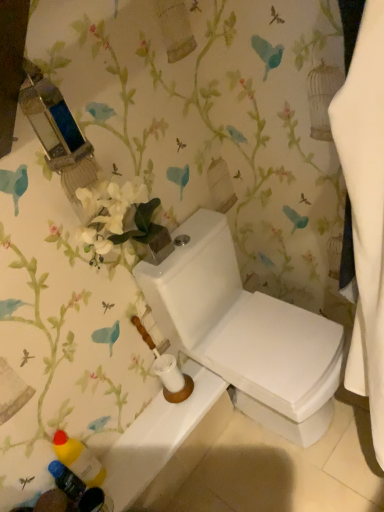
The height and width of the screenshot is (512, 384). I want to click on translucent plastic bottles at lower left, which ranks as the second toiletry in bottom-to-top order, so click(78, 459).

What do you see at coordinates (245, 332) in the screenshot? I see `white glossy toilet at center` at bounding box center [245, 332].

What do you see at coordinates (67, 480) in the screenshot? The image size is (384, 512). I see `blue plastic bottle at lower left, which ranks as the 1th toiletry in bottom-to-top order` at bounding box center [67, 480].

Locate an element on the screen. The width and height of the screenshot is (384, 512). white glossy toilet at lower center is located at coordinates (166, 442).

From a real-world perspective, between white glossy toilet at lower center and blue plastic bottle at lower left, which ranks as the 1th toiletry in bottom-to-top order, who is vertically higher?

From a 3D spatial view, blue plastic bottle at lower left, which ranks as the 1th toiletry in bottom-to-top order, is above.

Which is in front, point (201, 374) or point (61, 477)?

Positioned in front is point (61, 477).

Can you confirm if white glossy toilet at lower center is taller than blue plastic bottle at lower left, marked as the 2th toiletry in a top-to-bottom arrangement?

In fact, white glossy toilet at lower center may be shorter than blue plastic bottle at lower left, marked as the 2th toiletry in a top-to-bottom arrangement.

Which object is positioned more to the left, white glossy toilet at lower center or blue plastic bottle at lower left, which ranks as the 1th toiletry in bottom-to-top order?

blue plastic bottle at lower left, which ranks as the 1th toiletry in bottom-to-top order, is more to the left.

From the picture: Considering the sizes of objects blue plastic bottle at lower left, which ranks as the 1th toiletry in bottom-to-top order, and white glossy toilet at lower center in the image provided, who is wider, blue plastic bottle at lower left, which ranks as the 1th toiletry in bottom-to-top order, or white glossy toilet at lower center?

Wider between the two is white glossy toilet at lower center.

Is blue plastic bottle at lower left, which ranks as the 1th toiletry in bottom-to-top order, facing towards white glossy toilet at lower center?

A: No.

Considering the positions of points (82, 492) and (125, 449), is point (82, 492) closer to camera compared to point (125, 449)?

Yes, it is.

In the image, is blue plastic bottle at lower left, marked as the 2th toiletry in a top-to-bottom arrangement, positioned in front of or behind white glossy toilet at lower center?

Visually, blue plastic bottle at lower left, marked as the 2th toiletry in a top-to-bottom arrangement, is located in front of white glossy toilet at lower center.

Which point is more distant from viewer, (207, 255) or (59, 484)?

Positioned behind is point (207, 255).

Is white glossy toilet at center not inside blue plastic bottle at lower left, marked as the 2th toiletry in a top-to-bottom arrangement?

Yes, white glossy toilet at center is outside of blue plastic bottle at lower left, marked as the 2th toiletry in a top-to-bottom arrangement.

From the image's perspective, between white glossy toilet at center and blue plastic bottle at lower left, which ranks as the 1th toiletry in bottom-to-top order, who is located below?

blue plastic bottle at lower left, which ranks as the 1th toiletry in bottom-to-top order, is shown below in the image.

Is white glossy toilet at center facing away from blue plastic bottle at lower left, marked as the 2th toiletry in a top-to-bottom arrangement?

No, white glossy toilet at center's orientation is not away from blue plastic bottle at lower left, marked as the 2th toiletry in a top-to-bottom arrangement.

The image size is (384, 512). What are the coordinates of `toilet positioned vertically above the blue plastic bottle at lower left, which ranks as the 1th toiletry in bottom-to-top order (from a real-world perspective)` in the screenshot? It's located at (245, 332).

Considering the positions of objects blue plastic bottle at lower left, marked as the 2th toiletry in a top-to-bottom arrangement, and white glossy toilet at center in the image provided, who is more to the right, blue plastic bottle at lower left, marked as the 2th toiletry in a top-to-bottom arrangement, or white glossy toilet at center?

white glossy toilet at center.

From the image's perspective, is blue plastic bottle at lower left, marked as the 2th toiletry in a top-to-bottom arrangement, located above white glossy toilet at center?

Actually, blue plastic bottle at lower left, marked as the 2th toiletry in a top-to-bottom arrangement, appears below white glossy toilet at center in the image.

From a real-world perspective, is blue plastic bottle at lower left, which ranks as the 1th toiletry in bottom-to-top order, positioned under white glossy toilet at center based on gravity?

Correct, in the physical world, blue plastic bottle at lower left, which ranks as the 1th toiletry in bottom-to-top order, is lower than white glossy toilet at center.

Considering the relative sizes of white glossy toilet at lower center and white glossy toilet at center in the image provided, is white glossy toilet at lower center shorter than white glossy toilet at center?

Correct, white glossy toilet at lower center is not as tall as white glossy toilet at center.

Is white glossy toilet at lower center bigger or smaller than white glossy toilet at center?

In the image, white glossy toilet at lower center appears to be smaller than white glossy toilet at center.

In the image, is white glossy toilet at lower center on the left side or the right side of white glossy toilet at center?

From the image, it's evident that white glossy toilet at lower center is to the left of white glossy toilet at center.

Is point (171, 414) in front of point (138, 280)?

No.

From a real-world perspective, is translucent plastic bottles at lower left, which appears as the 1th toiletry when viewed from the top, located beneath white glossy toilet at lower center?

No, from a real-world perspective, translucent plastic bottles at lower left, which appears as the 1th toiletry when viewed from the top, is not below white glossy toilet at lower center.

Which object is thinner, translucent plastic bottles at lower left, which appears as the 1th toiletry when viewed from the top, or white glossy toilet at lower center?

translucent plastic bottles at lower left, which appears as the 1th toiletry when viewed from the top.

In the scene shown: Is translucent plastic bottles at lower left, which appears as the 1th toiletry when viewed from the top, located outside white glossy toilet at lower center?

That's correct, translucent plastic bottles at lower left, which appears as the 1th toiletry when viewed from the top, is outside of white glossy toilet at lower center.

Which object is more forward, white glossy toilet at lower center or translucent plastic bottles at lower left, which ranks as the second toiletry in bottom-to-top order?

Positioned in front is translucent plastic bottles at lower left, which ranks as the second toiletry in bottom-to-top order.

Is white glossy toilet at lower center not close to translucent plastic bottles at lower left, which ranks as the second toiletry in bottom-to-top order?

white glossy toilet at lower center is near translucent plastic bottles at lower left, which ranks as the second toiletry in bottom-to-top order, not far away.

Consider the image. From the image's perspective, is white glossy toilet at lower center below translucent plastic bottles at lower left, which ranks as the second toiletry in bottom-to-top order?

No, from the image's perspective, white glossy toilet at lower center is not below translucent plastic bottles at lower left, which ranks as the second toiletry in bottom-to-top order.

Between white glossy toilet at lower center and translucent plastic bottles at lower left, which appears as the 1th toiletry when viewed from the top, which one has smaller width?

translucent plastic bottles at lower left, which appears as the 1th toiletry when viewed from the top.

In order to click on bath on the right side of blue plastic bottle at lower left, marked as the 2th toiletry in a top-to-bottom arrangement in this screenshot , I will do `click(166, 442)`.

Find the location of `toiletry that is the 2nd object located below the white glossy toilet at lower center (from the image's perspective)`. toiletry that is the 2nd object located below the white glossy toilet at lower center (from the image's perspective) is located at coordinates (67, 480).

When comparing their distances from white glossy toilet at lower center, does translucent plastic bottles at lower left, which ranks as the second toiletry in bottom-to-top order, or blue plastic bottle at lower left, marked as the 2th toiletry in a top-to-bottom arrangement, seem closer?

The object closer to white glossy toilet at lower center is translucent plastic bottles at lower left, which ranks as the second toiletry in bottom-to-top order.

Which object lies further to the anchor point blue plastic bottle at lower left, marked as the 2th toiletry in a top-to-bottom arrangement, translucent plastic bottles at lower left, which appears as the 1th toiletry when viewed from the top, or white glossy toilet at center?

white glossy toilet at center lies further to blue plastic bottle at lower left, marked as the 2th toiletry in a top-to-bottom arrangement, than the other object.

From the image, which object appears to be farther from blue plastic bottle at lower left, marked as the 2th toiletry in a top-to-bottom arrangement, white glossy toilet at center or translucent plastic bottles at lower left, which appears as the 1th toiletry when viewed from the top?

Among the two, white glossy toilet at center is located further to blue plastic bottle at lower left, marked as the 2th toiletry in a top-to-bottom arrangement.

From the image, which object appears to be farther from white glossy toilet at center, blue plastic bottle at lower left, which ranks as the 1th toiletry in bottom-to-top order, or translucent plastic bottles at lower left, which ranks as the second toiletry in bottom-to-top order?

blue plastic bottle at lower left, which ranks as the 1th toiletry in bottom-to-top order, is positioned further to the anchor white glossy toilet at center.

Considering their positions, is white glossy toilet at center positioned closer to white glossy toilet at lower center than blue plastic bottle at lower left, marked as the 2th toiletry in a top-to-bottom arrangement?

blue plastic bottle at lower left, marked as the 2th toiletry in a top-to-bottom arrangement, is positioned closer to the anchor white glossy toilet at lower center.

When comparing their distances from white glossy toilet at lower center, does white glossy toilet at center or translucent plastic bottles at lower left, which appears as the 1th toiletry when viewed from the top, seem further?

The object further to white glossy toilet at lower center is white glossy toilet at center.

Considering their positions, is translucent plastic bottles at lower left, which appears as the 1th toiletry when viewed from the top, positioned closer to blue plastic bottle at lower left, marked as the 2th toiletry in a top-to-bottom arrangement, than white glossy toilet at lower center?

translucent plastic bottles at lower left, which appears as the 1th toiletry when viewed from the top, is closer to blue plastic bottle at lower left, marked as the 2th toiletry in a top-to-bottom arrangement.

Estimate the real-world distances between objects in this image. Which object is further from translucent plastic bottles at lower left, which appears as the 1th toiletry when viewed from the top, blue plastic bottle at lower left, marked as the 2th toiletry in a top-to-bottom arrangement, or white glossy toilet at lower center?

Among the two, white glossy toilet at lower center is located further to translucent plastic bottles at lower left, which appears as the 1th toiletry when viewed from the top.

At what (x,y) coordinates should I click in order to perform the action: click on toiletry situated between blue plastic bottle at lower left, which ranks as the 1th toiletry in bottom-to-top order, and white glossy toilet at lower center from left to right. Please return your answer as a coordinate pair (x, y). The image size is (384, 512). Looking at the image, I should click on (78, 459).

The image size is (384, 512). I want to click on toiletry between blue plastic bottle at lower left, which ranks as the 1th toiletry in bottom-to-top order, and white glossy toilet at center, in the horizontal direction, so click(x=78, y=459).

Locate an element on the screen. The image size is (384, 512). bath between translucent plastic bottles at lower left, which ranks as the second toiletry in bottom-to-top order, and white glossy toilet at center is located at coordinates (166, 442).

Identify the location of bath located between blue plastic bottle at lower left, marked as the 2th toiletry in a top-to-bottom arrangement, and white glossy toilet at center in the left-right direction. (166, 442).